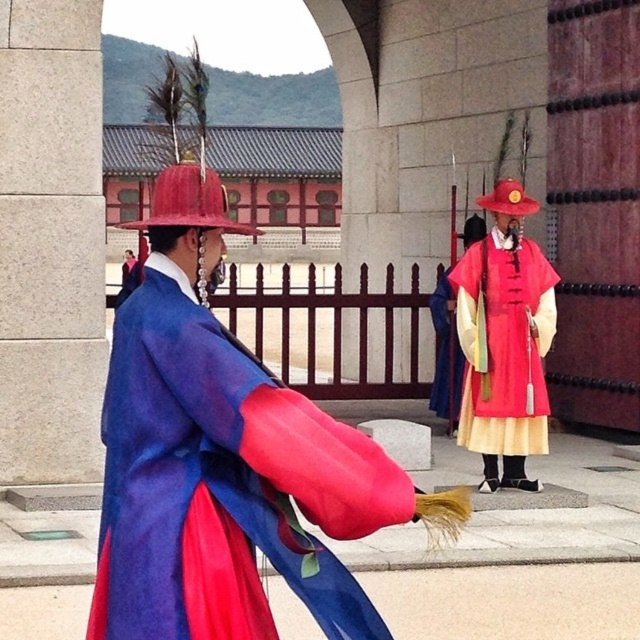
Is matte blue silk robe at center to the left of matte red and yellow robe at center from the viewer's perspective?

Yes, matte blue silk robe at center is to the left of matte red and yellow robe at center.

Between point (186, 579) and point (534, 390), which one is positioned in front?

Point (186, 579) is in front.

Which is in front, point (120, 461) or point (456, 310)?

Point (120, 461)

Find the location of a particular element. matte blue silk robe at center is located at coordinates pos(221,483).